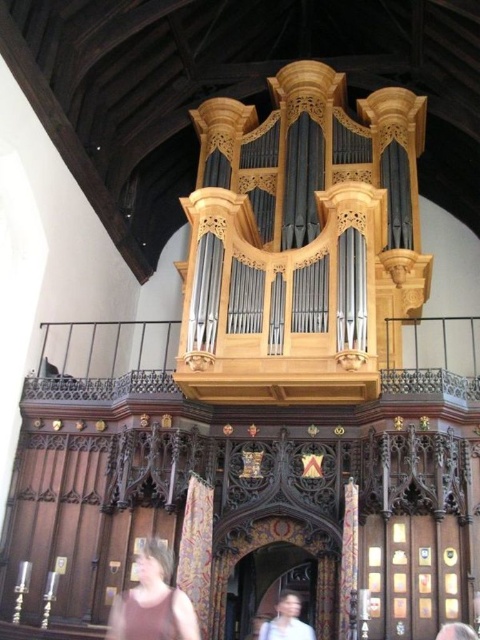
Is the position of brown textured shirt at lower center less distant than that of light brown hair at lower center?

Yes, brown textured shirt at lower center is closer to the viewer.

Does brown textured shirt at lower center have a lesser width compared to light brown hair at lower center?

Incorrect, brown textured shirt at lower center's width is not less than light brown hair at lower center's.

Who is more forward, (178, 628) or (282, 621)?

Positioned in front is point (178, 628).

The height and width of the screenshot is (640, 480). Find the location of `brown textured shirt at lower center`. brown textured shirt at lower center is located at coordinates (153, 602).